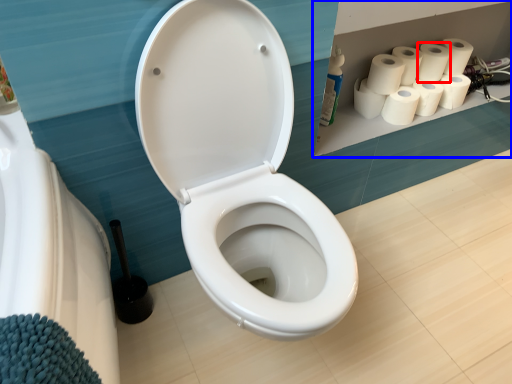
Question: Which point is further to the camera, paper towel (highlighted by a red box) or shelf (highlighted by a blue box)?

Choices:
 (A) paper towel
 (B) shelf

Answer: (A)